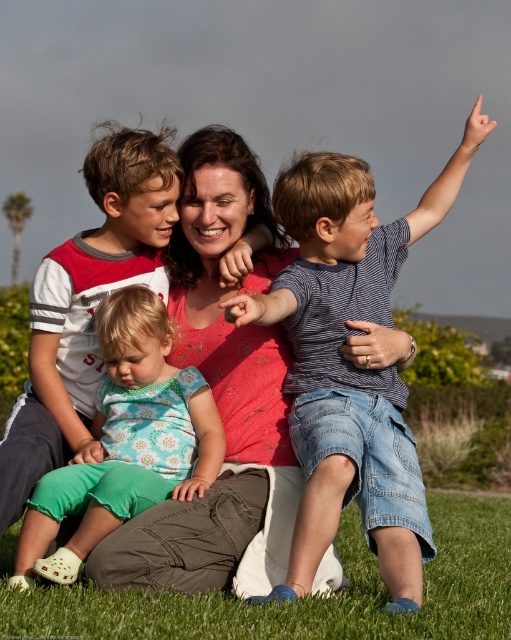
Is point (359, 291) more distant than point (129, 490)?

Yes, point (359, 291) is farther from viewer.

Can you confirm if striped cotton shirt at right is positioned below floral fabric dress at lower left?

No, striped cotton shirt at right is not below floral fabric dress at lower left.

What do you see at coordinates (363, 212) in the screenshot? This screenshot has width=511, height=640. I see `striped cotton shirt at right` at bounding box center [363, 212].

Find the location of a particular element. The height and width of the screenshot is (640, 511). striped cotton shirt at right is located at coordinates (363, 212).

Does point (373, 506) lie behind point (86, 180)?

No, it is not.

Who is more forward, (367, 257) or (61, 465)?

Point (61, 465) is more forward.

Identify the location of striped cotton shirt at right. (363, 212).

Between white striped shirt at left and floral fabric dress at lower left, which one has less height?

floral fabric dress at lower left

Which is in front, point (104, 243) or point (134, 420)?

Point (134, 420)

Where is `white striped shirt at left`? Image resolution: width=511 pixels, height=640 pixels. white striped shirt at left is located at coordinates (86, 305).